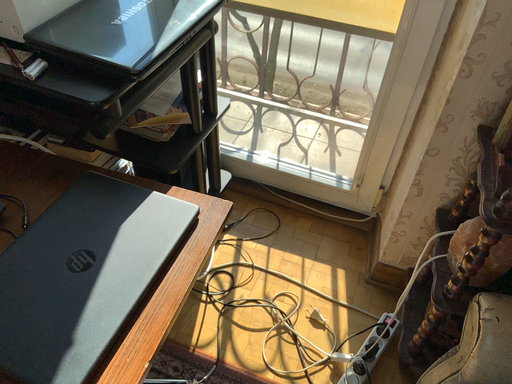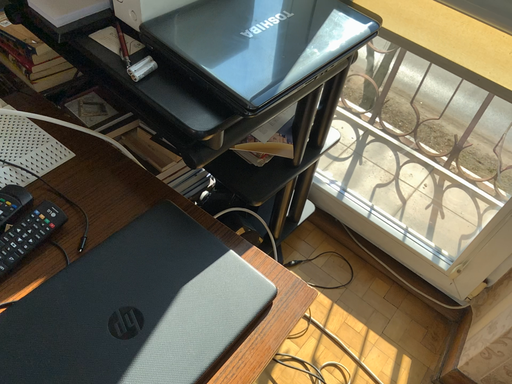
Question: Which way did the camera rotate in the video?

Choices:
 (A) rotated right
 (B) rotated left

Answer: (B)